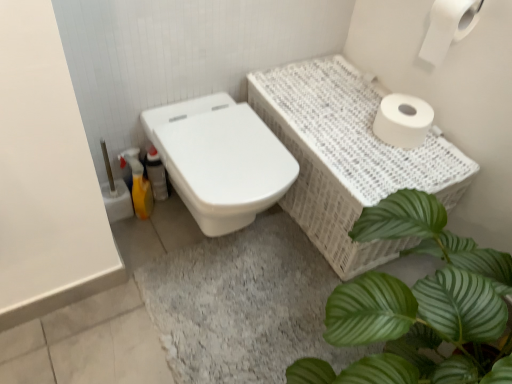
You are a GUI agent. You are given a task and a screenshot of the screen. Output one action in this format:
    pyautogui.click(x=<x>, y=<y>)
    Task: Click on the free point above white glossy toilet at center (from a real-world perspective)
    Image resolution: width=512 pixels, height=384 pixels.
    Given the screenshot: What is the action you would take?
    pyautogui.click(x=222, y=139)